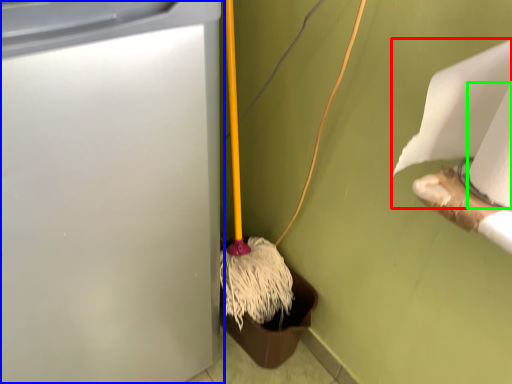
Question: Which is farther away from toilet paper (highlighted by a red box)? waste container (highlighted by a blue box) or toilet paper (highlighted by a green box)?

Choices:
 (A) waste container
 (B) toilet paper

Answer: (A)